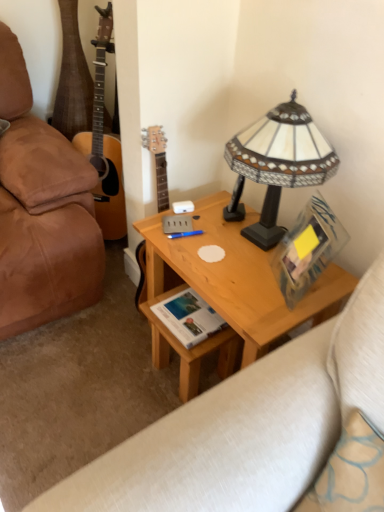
You are a GUI agent. You are given a task and a screenshot of the screen. Output one action in this format:
    pyautogui.click(x=<x>, y=<y>)
    Task: Click on the free space to the back side of blue plastic pen at center
    This screenshot has height=512, width=384.
    Given the screenshot: What is the action you would take?
    pyautogui.click(x=204, y=213)